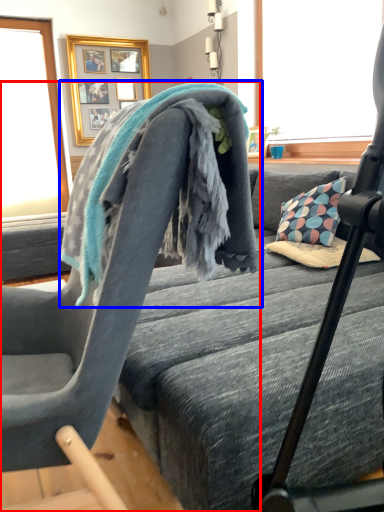
Question: Among these objects, which one is nearest to the camera, chair (highlighted by a red box) or bath towel (highlighted by a blue box)?

Choices:
 (A) chair
 (B) bath towel

Answer: (A)